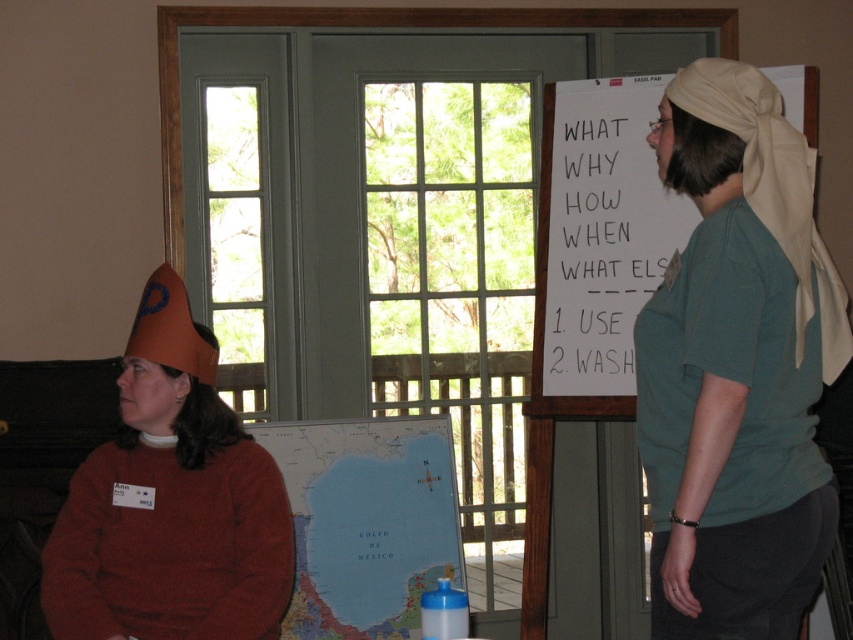
You are standing in the room and want to hand a pen to the person wearing the green cotton shirt at right. Based on their position, where should you approach to give them the pen?

The green cotton shirt at right is located at point 0.573 on the x axis and 0.865 on the y axis, so you should approach the area near those coordinates to hand them the pen.

You are organizing a treasure hunt game in this room. You have an orange felt cone hat at left and a map paper at center. To set up the next clue, you need to place a golden coin between them. Where should you put the golden coin?

The orange felt cone hat at left is to the left of the map paper at center, so you should place the golden coin between the orange felt cone hat at left and the map paper at center, exactly halfway between their positions.